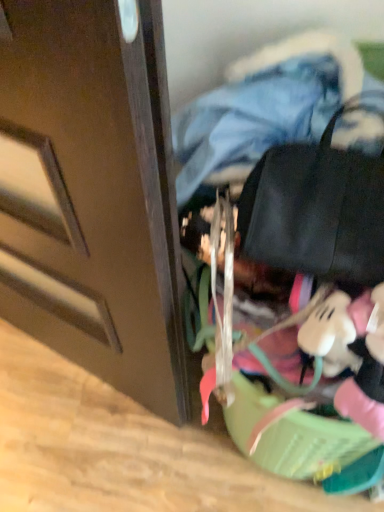
Question: Relative to denim jacket at upper center, is black leather messenger bag at upper right in front or behind?

Choices:
 (A) front
 (B) behind

Answer: (A)

Question: Is black leather messenger bag at upper right wider or thinner than denim jacket at upper center?

Choices:
 (A) wide
 (B) thin

Answer: (B)

Question: From a real-world perspective, is black leather messenger bag at upper right above or below denim jacket at upper center?

Choices:
 (A) above
 (B) below

Answer: (B)

Question: From the image's perspective, is denim jacket at upper center positioned above or below black leather messenger bag at upper right?

Choices:
 (A) above
 (B) below

Answer: (A)

Question: Considering the positions of denim jacket at upper center and black leather messenger bag at upper right in the image, is denim jacket at upper center wider or thinner than black leather messenger bag at upper right?

Choices:
 (A) wide
 (B) thin

Answer: (A)

Question: From a real-world perspective, relative to black leather messenger bag at upper right, is denim jacket at upper center vertically above or below?

Choices:
 (A) below
 (B) above

Answer: (B)

Question: Looking at the image, does denim jacket at upper center seem bigger or smaller compared to black leather messenger bag at upper right?

Choices:
 (A) big
 (B) small

Answer: (A)